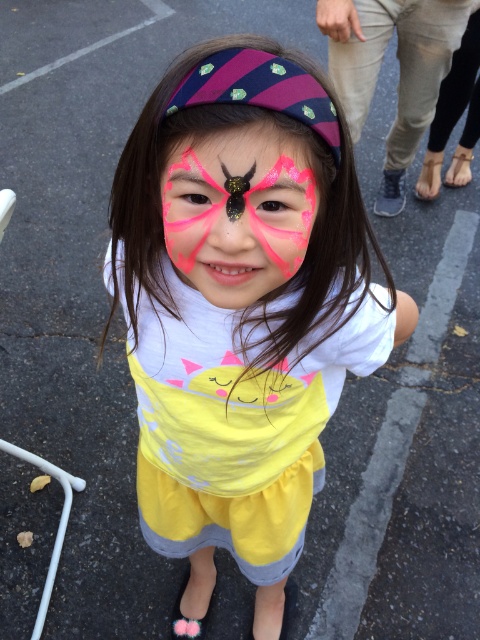
Does matte white shirt at center have a greater height compared to pink glitter butterfly at center?

Yes.

Based on the photo, does matte white shirt at center appear on the left side of pink glitter butterfly at center?

In fact, matte white shirt at center is to the right of pink glitter butterfly at center.

Is point (295, 195) closer to camera compared to point (251, 129)?

No, (295, 195) is further to viewer.

This screenshot has width=480, height=640. Identify the location of matte white shirt at center. (241, 308).